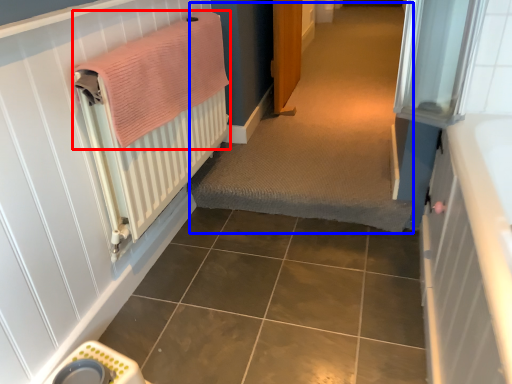
Question: Which object is closer to the camera taking this photo, bath towel (highlighted by a red box) or plain (highlighted by a blue box)?

Choices:
 (A) bath towel
 (B) plain

Answer: (A)